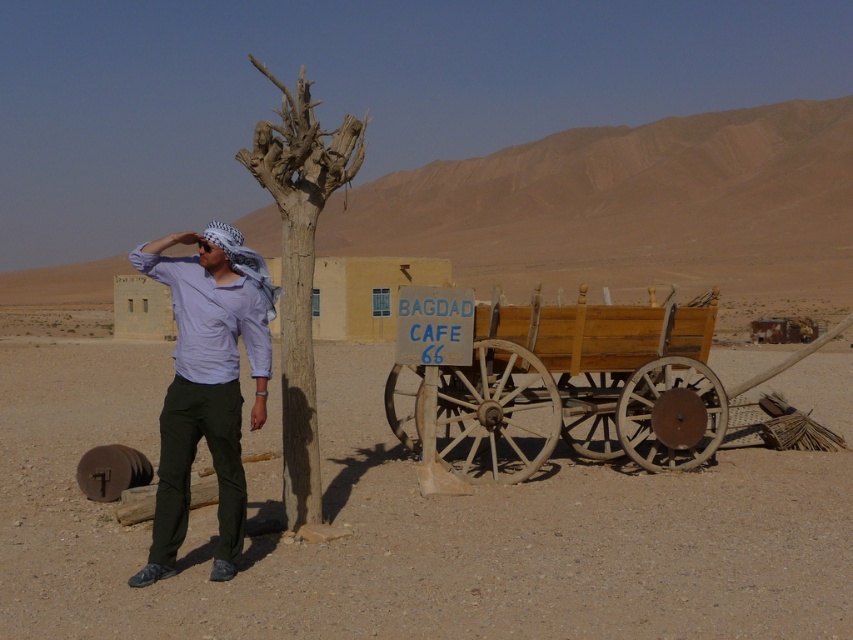
You are a traveler in the desert and want to know which point is closer to you. The points are point [698,378] and point [187,384]. Which point is closer?

Point [187,384] is closer to you because it is less further than point [698,378].

You are a traveler in the desert who wants to find shade. You see a wooden wagon at center and a brown rough tree at center. Which object is closer to the ground and might provide shade?

The wooden wagon at center is located below brown rough tree at center, so the wooden wagon at center is closer to the ground and might provide shade.

You are a traveler in the desert and want to take a photo of both the matte purple shirt at left and the brown rough tree at center. Which object should you focus on first to ensure both are in the frame?

You should focus on the matte purple shirt at left first because it is closer to the viewer than the brown rough tree at center, so adjusting the camera to include both would require starting with the closer object.